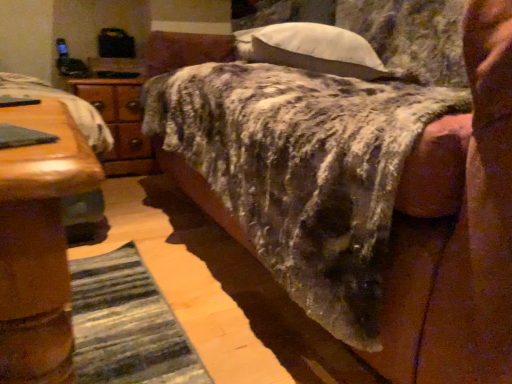
This screenshot has width=512, height=384. What do you see at coordinates (120, 123) in the screenshot? I see `wooden nightstand at left` at bounding box center [120, 123].

At what (x,y) coordinates should I click in order to perform the action: click on textured wool blanket at center. Please return your answer as a coordinate pair (x, y). This screenshot has height=384, width=512. Looking at the image, I should click on (365, 196).

This screenshot has width=512, height=384. Identify the location of white soft pillow at upper center. (312, 49).

Find the location of a particular element. The image size is (512, 384). pillow lying on the right of wooden nightstand at left is located at coordinates (312, 49).

Consider the image. Between white soft pillow at upper center and wooden nightstand at left, which one has more height?

wooden nightstand at left.

Between white soft pillow at upper center and wooden nightstand at left, which one has larger size?

wooden nightstand at left.

Which object is positioned more to the right, white soft pillow at upper center or wooden nightstand at left?

white soft pillow at upper center.

Which object is further away from the camera taking this photo, wooden nightstand at left or textured wool blanket at center?

wooden nightstand at left is behind.

Which point is more distant from viewer, (126, 144) or (288, 259)?

Point (126, 144)

Which of these two, wooden nightstand at left or textured wool blanket at center, stands shorter?

wooden nightstand at left is shorter.

Considering the sizes of objects wooden nightstand at left and textured wool blanket at center in the image provided, who is bigger, wooden nightstand at left or textured wool blanket at center?

textured wool blanket at center.

Who is taller, textured wool blanket at center or wooden nightstand at left?

textured wool blanket at center.

Would you say textured wool blanket at center is outside wooden nightstand at left?

textured wool blanket at center is positioned outside wooden nightstand at left.

Based on their sizes in the image, would you say textured wool blanket at center is bigger or smaller than wooden nightstand at left?

Clearly, textured wool blanket at center is larger in size than wooden nightstand at left.

Between textured wool blanket at center and wooden nightstand at left, which one is positioned in front?

textured wool blanket at center is closer to the camera.

Looking at this image, from a real-world perspective, is textured wool blanket at center positioned above or below white soft pillow at upper center?

In terms of real-world spatial position, textured wool blanket at center is below white soft pillow at upper center.

Is textured wool blanket at center bigger than white soft pillow at upper center?

Correct, textured wool blanket at center is larger in size than white soft pillow at upper center.

Between textured wool blanket at center and white soft pillow at upper center, which one has more height?

With more height is textured wool blanket at center.

Considering the positions of objects textured wool blanket at center and white soft pillow at upper center in the image provided, who is more to the right, textured wool blanket at center or white soft pillow at upper center?

textured wool blanket at center is more to the right.

From a real-world perspective, between white soft pillow at upper center and textured wool blanket at center, who is vertically lower?

textured wool blanket at center, from a real-world perspective.

Which object is thinner, white soft pillow at upper center or textured wool blanket at center?

white soft pillow at upper center.

Considering the relative sizes of white soft pillow at upper center and textured wool blanket at center in the image provided, is white soft pillow at upper center taller than textured wool blanket at center?

No, white soft pillow at upper center is not taller than textured wool blanket at center.

Would you consider white soft pillow at upper center to be distant from textured wool blanket at center?

white soft pillow at upper center is near textured wool blanket at center, not far away.

How many degrees apart are the facing directions of wooden nightstand at left and white soft pillow at upper center?

The facing directions of wooden nightstand at left and white soft pillow at upper center are 106 degrees apart.

Between wooden nightstand at left and white soft pillow at upper center, which one appears on the left side from the viewer's perspective?

wooden nightstand at left is more to the left.

Based on the photo, is wooden nightstand at left oriented towards white soft pillow at upper center?

Yes, wooden nightstand at left is facing white soft pillow at upper center.

Is wooden nightstand at left closer to the viewer compared to white soft pillow at upper center?

No, wooden nightstand at left is further to the viewer.

Find the location of a particular element. Image resolution: width=512 pixels, height=384 pixels. pillow on the right of wooden nightstand at left is located at coordinates (312, 49).

The width and height of the screenshot is (512, 384). I want to click on bed above the wooden nightstand at left (from a real-world perspective), so click(365, 196).

Looking at this image, from the image, which object appears to be farther from white soft pillow at upper center, wooden nightstand at left or textured wool blanket at center?

wooden nightstand at left.

From the image, which object appears to be farther from textured wool blanket at center, wooden nightstand at left or white soft pillow at upper center?

Based on the image, wooden nightstand at left appears to be further to textured wool blanket at center.

From the picture: From the image, which object appears to be farther from textured wool blanket at center, white soft pillow at upper center or wooden nightstand at left?

The object further to textured wool blanket at center is wooden nightstand at left.

Estimate the real-world distances between objects in this image. Which object is closer to wooden nightstand at left, textured wool blanket at center or white soft pillow at upper center?

Among the two, white soft pillow at upper center is located nearer to wooden nightstand at left.

Based on the photo, which object lies further to the anchor point white soft pillow at upper center, textured wool blanket at center or wooden nightstand at left?

The object further to white soft pillow at upper center is wooden nightstand at left.

Estimate the real-world distances between objects in this image. Which object is further from wooden nightstand at left, white soft pillow at upper center or textured wool blanket at center?

Among the two, textured wool blanket at center is located further to wooden nightstand at left.

You are a GUI agent. You are given a task and a screenshot of the screen. Output one action in this format:
    pyautogui.click(x=<x>, y=<y>)
    Task: Click on the pillow between textured wool blanket at center and wooden nightstand at left from front to back
    
    Given the screenshot: What is the action you would take?
    pyautogui.click(x=312, y=49)